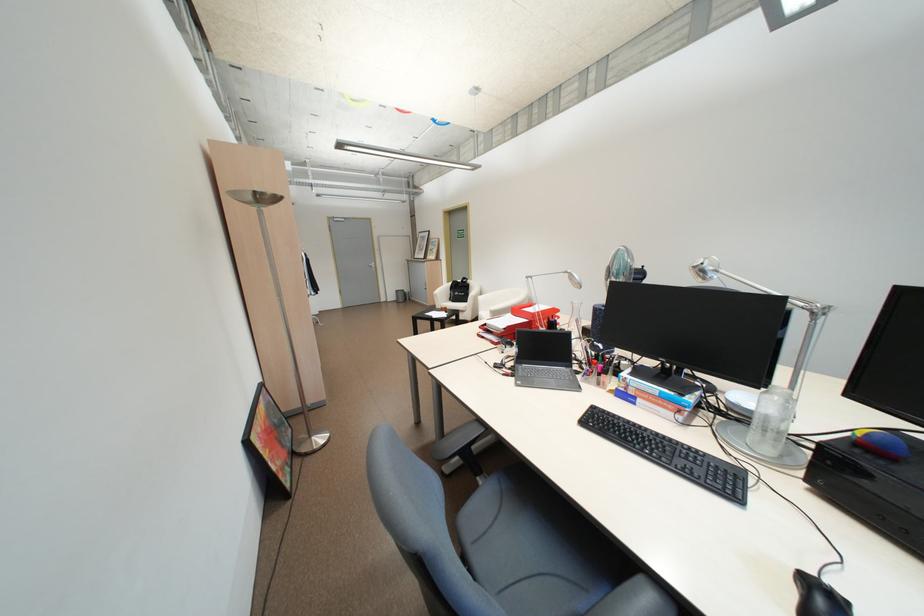
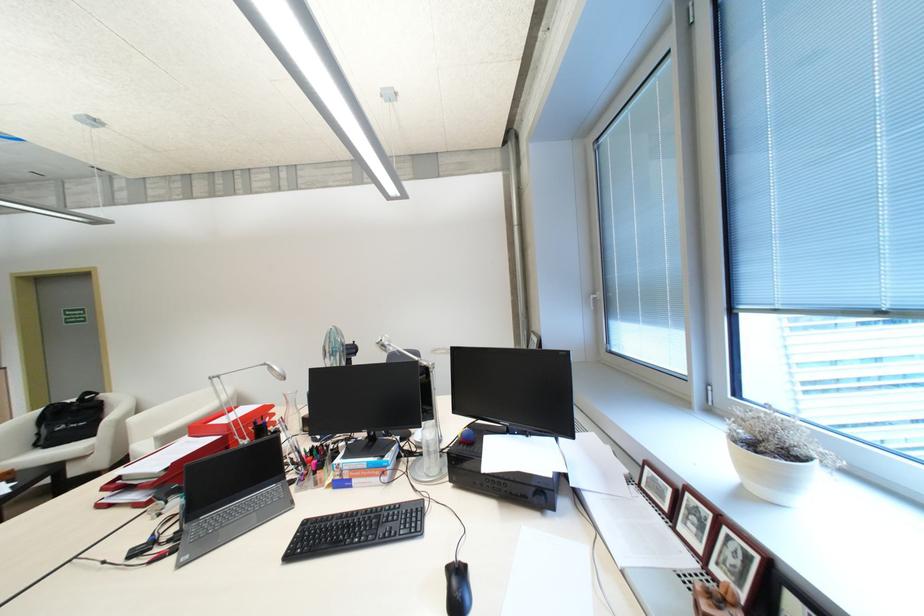
Find the pixel in the second image that matches pixel 542 313 in the first image.

(237, 424)